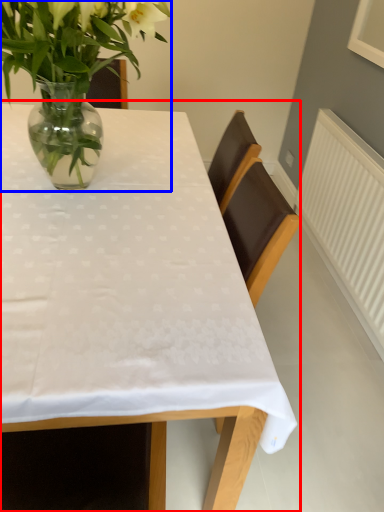
Question: Which point is further to the camera, table (highlighted by a red box) or houseplant (highlighted by a blue box)?

Choices:
 (A) table
 (B) houseplant

Answer: (B)